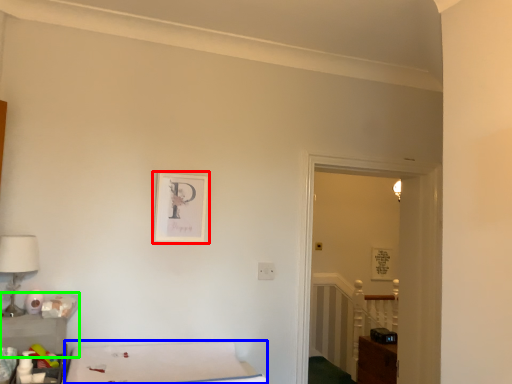
Question: Based on their relative distances, which object is nearer to picture frame (highlighted by a red box)? Choose from furniture (highlighted by a blue box) and table (highlighted by a green box).

Choices:
 (A) furniture
 (B) table

Answer: (A)